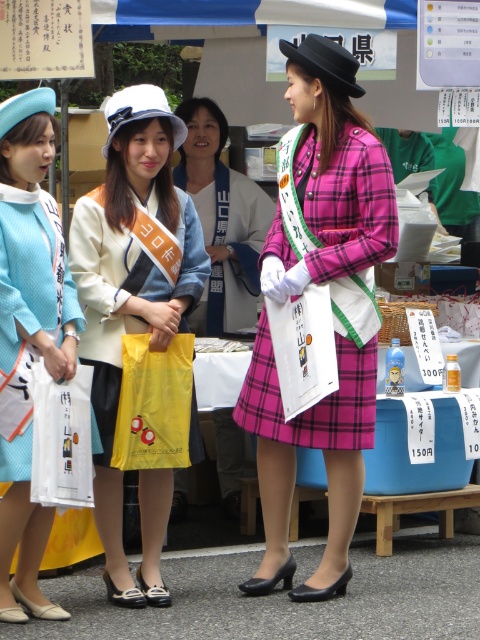
From the picture: You are a photographer at the event and want to capture both the matte yellow plastic bag at center and the pink plaid dress at center in a single frame. Which object should you focus on first to ensure both are in the shot?

The matte yellow plastic bag at center is positioned on the left side of the pink plaid dress at center, so you should focus on the pink plaid dress at center first to ensure both are included in the frame.